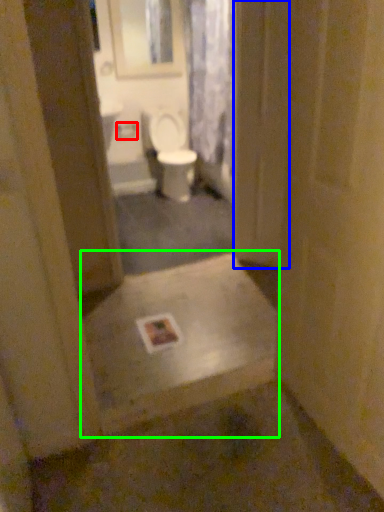
Question: Estimate the real-world distances between objects in this image. Which object is farther from toilet paper (highlighted by a red box), screen door (highlighted by a blue box) or landing (highlighted by a green box)?

Choices:
 (A) screen door
 (B) landing

Answer: (B)